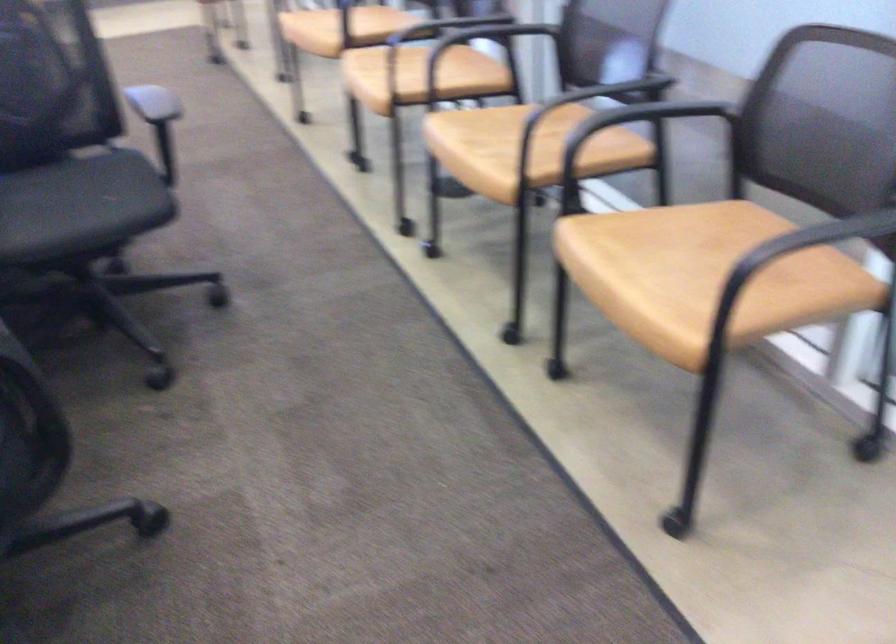
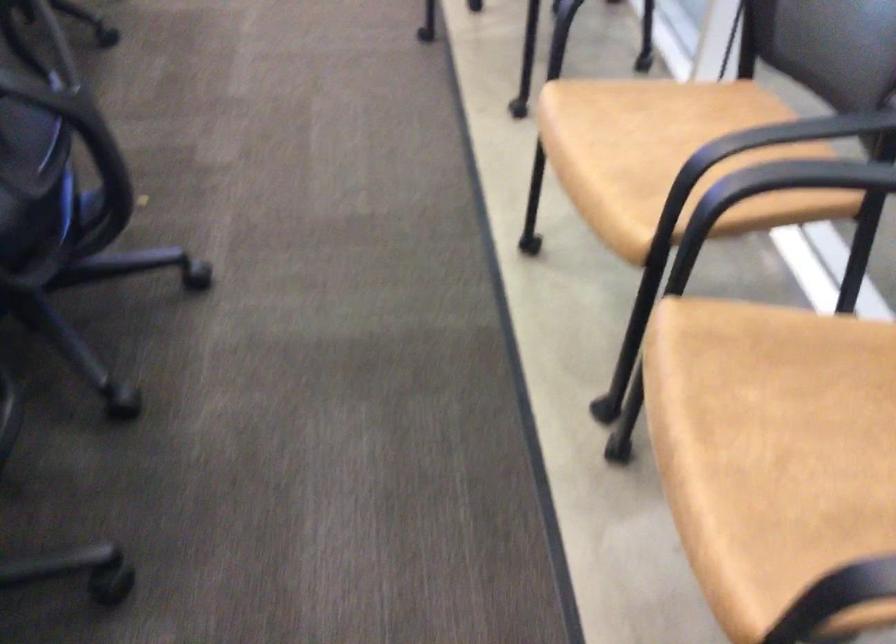
Locate, in the second image, the point that corresponds to [403,73] in the first image.

(791, 450)